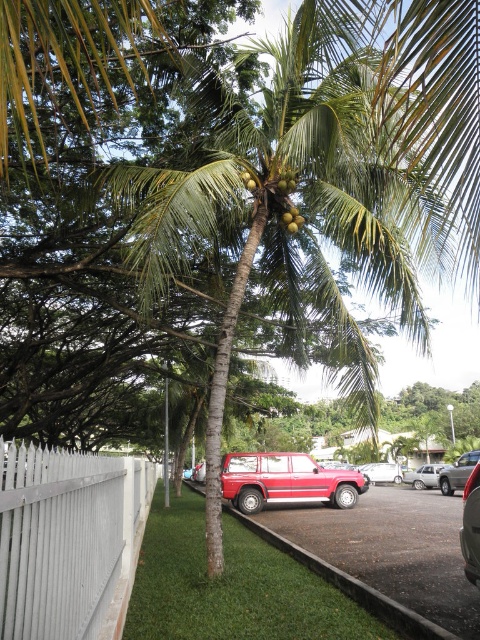
Can you confirm if white painted wood fence at lower left is wider than green matte coconut at upper center?

Correct, the width of white painted wood fence at lower left exceeds that of green matte coconut at upper center.

You are a GUI agent. You are given a task and a screenshot of the screen. Output one action in this format:
    pyautogui.click(x=<x>, y=<y>)
    Task: Click on the white painted wood fence at lower left
    The image size is (480, 640).
    Given the screenshot: What is the action you would take?
    pyautogui.click(x=69, y=540)

At what (x,y) coordinates should I click in order to perform the action: click on white painted wood fence at lower left. Please return your answer as a coordinate pair (x, y). The image size is (480, 640). Looking at the image, I should click on (69, 540).

Who is positioned more to the right, satin silver sedan at center or green matte coconut at center?

satin silver sedan at center is more to the right.

Is satin silver sedan at center closer to camera compared to green matte coconut at center?

No, it is not.

Is point (444, 465) farther from camera compared to point (280, 182)?

Yes.

Locate an element on the screen. satin silver sedan at center is located at coordinates (423, 476).

Who is shorter, green leafy palm tree at center or satin silver sedan at center?

With less height is green leafy palm tree at center.

Consider the image. Does green leafy palm tree at center have a larger size compared to satin silver sedan at center?

Actually, green leafy palm tree at center might be smaller than satin silver sedan at center.

Does point (172, 198) come closer to viewer compared to point (409, 481)?

Yes, it is.

You are a GUI agent. You are given a task and a screenshot of the screen. Output one action in this format:
    pyautogui.click(x=<x>, y=<y>)
    Task: Click on the green leafy palm tree at center
    The image size is (480, 640).
    Given the screenshot: What is the action you would take?
    pyautogui.click(x=284, y=204)